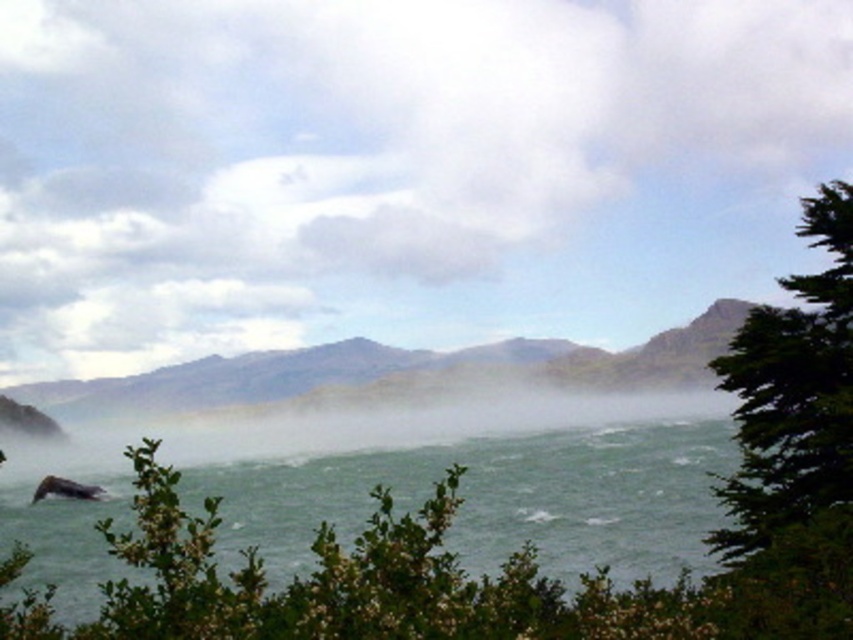
Question: Which point is farther to the camera?

Choices:
 (A) (548, 572)
 (B) (827, 486)

Answer: (A)

Question: Which point is farther to the camera?

Choices:
 (A) (349, 506)
 (B) (236, 380)

Answer: (B)

Question: Is rugged rock mountain at center thinner than green leafy tree at right?

Choices:
 (A) yes
 (B) no

Answer: (B)

Question: Does green rough water at lower left lie in front of green leafy tree at right?

Choices:
 (A) no
 (B) yes

Answer: (B)

Question: Which point is farther to the camera?

Choices:
 (A) (285, 390)
 (B) (750, 396)

Answer: (A)

Question: Does green rough water at lower left have a smaller size compared to rugged rock mountain at center?

Choices:
 (A) no
 (B) yes

Answer: (B)